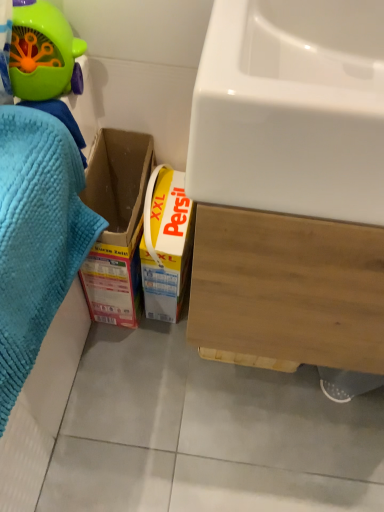
Question: Could you tell me if white glossy sink at upper right is facing blue textured towel at left?

Choices:
 (A) yes
 (B) no

Answer: (B)

Question: Is white glossy sink at upper right turned away from blue textured towel at left?

Choices:
 (A) yes
 (B) no

Answer: (B)

Question: Can you confirm if white glossy sink at upper right is positioned to the right of blue textured towel at left?

Choices:
 (A) no
 (B) yes

Answer: (B)

Question: Does white glossy sink at upper right have a greater height compared to blue textured towel at left?

Choices:
 (A) no
 (B) yes

Answer: (A)

Question: From a real-world perspective, is white glossy sink at upper right under blue textured towel at left?

Choices:
 (A) yes
 (B) no

Answer: (B)

Question: Does point (59, 287) appear closer or farther from the camera than point (301, 67)?

Choices:
 (A) farther
 (B) closer

Answer: (A)

Question: Which is correct: blue textured towel at left is inside white glossy sink at upper right, or outside of it?

Choices:
 (A) inside
 (B) outside

Answer: (B)

Question: From the image's perspective, is blue textured towel at left above or below white glossy sink at upper right?

Choices:
 (A) above
 (B) below

Answer: (B)

Question: Considering the positions of blue textured towel at left and white glossy sink at upper right in the image, is blue textured towel at left bigger or smaller than white glossy sink at upper right?

Choices:
 (A) small
 (B) big

Answer: (B)

Question: In terms of width, does green plastic toy at upper left look wider or thinner when compared to blue textured towel at left?

Choices:
 (A) wide
 (B) thin

Answer: (B)

Question: Looking at the image, does green plastic toy at upper left seem bigger or smaller compared to blue textured towel at left?

Choices:
 (A) big
 (B) small

Answer: (B)

Question: In terms of height, does green plastic toy at upper left look taller or shorter compared to blue textured towel at left?

Choices:
 (A) tall
 (B) short

Answer: (B)

Question: From a real-world perspective, is green plastic toy at upper left above or below blue textured towel at left?

Choices:
 (A) below
 (B) above

Answer: (B)

Question: From their relative heights in the image, would you say white glossy sink at upper right is taller or shorter than blue textured towel at left?

Choices:
 (A) tall
 (B) short

Answer: (B)

Question: Does point (359, 177) appear closer or farther from the camera than point (49, 197)?

Choices:
 (A) closer
 (B) farther

Answer: (A)